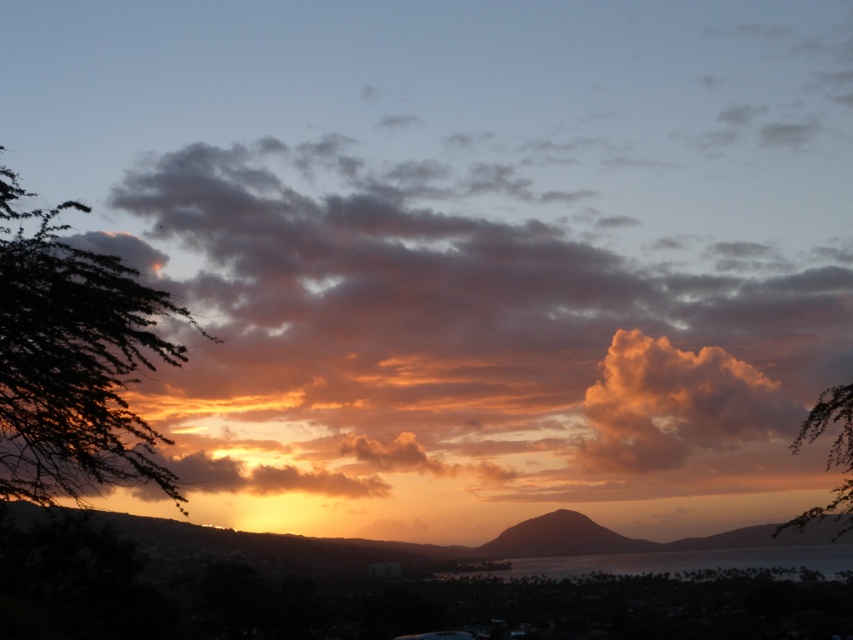
In the scene shown: You are standing at the coast watching the sunset and want to take a photo. There are two points marked in the scene, point A at coordinates point (639, 451) and point B at coordinates point (496, 572). Which point is closer to you, the observer?

Point A at coordinates point (639, 451) is closer to you because it is further to the viewer than point B at coordinates point (496, 572).

You are standing on the beach watching the sunset. You see the translucent glass water at lower center and the green leafy branch at right. Which object appears taller in the image?

The green leafy branch at right appears taller than the translucent glass water at lower center in the image.

You are an artist painting this sunset scene. You want to add a new element to the painting that will be placed between the translucent glass water at lower center and the green leafy branch at right. Is this possible?

The green leafy branch at right is behind the translucent glass water at lower center, so there is no space between them for adding a new element.